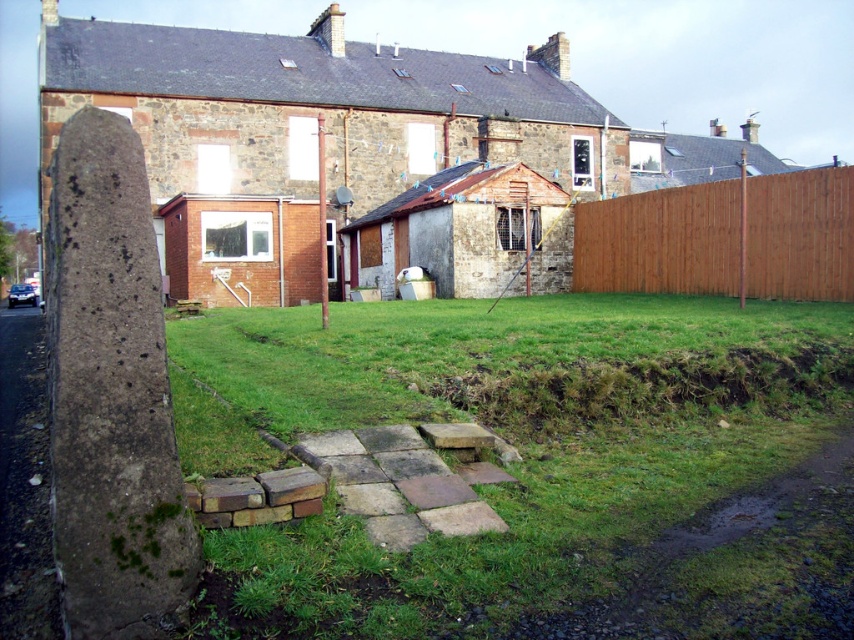
Question: Which point is farther to the camera?

Choices:
 (A) brown wooden fence at right
 (B) brown rough stone pillar at left
 (C) green grassy at center

Answer: (A)

Question: Which point appears closest to the camera in this image?

Choices:
 (A) (686, 195)
 (B) (814, 321)

Answer: (B)

Question: Which of the following is the closest to the observer?

Choices:
 (A) brown rough stone pillar at left
 (B) green grassy at center
 (C) brown wooden fence at right

Answer: (B)

Question: Does green grassy at center appear over brown wooden fence at right?

Choices:
 (A) no
 (B) yes

Answer: (A)

Question: Is brown rough stone pillar at left wider than brown wooden fence at right?

Choices:
 (A) no
 (B) yes

Answer: (A)

Question: Can you confirm if brown rough stone pillar at left is bigger than brown wooden fence at right?

Choices:
 (A) no
 (B) yes

Answer: (A)